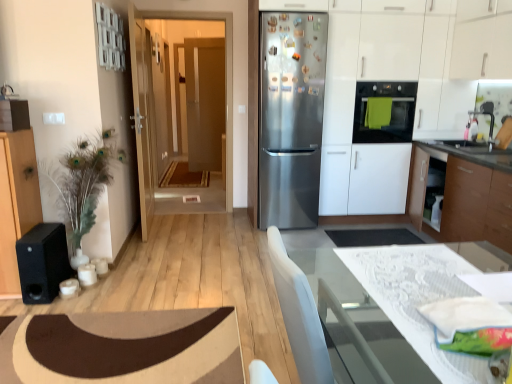
In order to face matte black oven at center right, should I rotate leftwards or rightwards?

Turn right approximately 17.108 degrees to face it.

What do you see at coordinates (205, 101) in the screenshot?
I see `matte wooden door at center, acting as the 2th door starting from the front` at bounding box center [205, 101].

What do you see at coordinates (470, 154) in the screenshot? This screenshot has height=384, width=512. I see `white glossy countertop at lower right` at bounding box center [470, 154].

This screenshot has width=512, height=384. What do you see at coordinates (42, 262) in the screenshot? I see `black matte speaker at left` at bounding box center [42, 262].

The width and height of the screenshot is (512, 384). What do you see at coordinates (143, 116) in the screenshot?
I see `wooden door at center, placed as the 2th door when sorted from back to front` at bounding box center [143, 116].

Measure the distance between point (340, 209) and camera.

Point (340, 209) is 4.31 meters from camera.

This screenshot has height=384, width=512. What do you see at coordinates (290, 116) in the screenshot? I see `stainless steel refrigerator at center` at bounding box center [290, 116].

Describe the element at coordinates (405, 302) in the screenshot. I see `white lace table at lower right` at that location.

This screenshot has height=384, width=512. What are the coordinates of `matte black oven at center right` in the screenshot? It's located at (384, 112).

Based on the photo, from the image's perspective, would you say white glossy countertop at lower right is positioned over satin white cabinet at right?

No, from the image's perspective, white glossy countertop at lower right is not on top of satin white cabinet at right.

At what (x,y) coordinates should I click in order to perform the action: click on countertop in front of the satin white cabinet at right. Please return your answer as a coordinate pair (x, y). The image size is (512, 384). Looking at the image, I should click on (470, 154).

Between white glossy countertop at lower right and satin white cabinet at right, which one is positioned in front?

white glossy countertop at lower right is more forward.

Can you tell me how much white glossy countertop at lower right and satin white cabinet at right differ in facing direction?

The angle between the facing direction of white glossy countertop at lower right and the facing direction of satin white cabinet at right is 90 degrees.

The width and height of the screenshot is (512, 384). Find the location of `dresser behind the wooden door at center, marked as the first door in a front-to-back arrangement`. dresser behind the wooden door at center, marked as the first door in a front-to-back arrangement is located at coordinates (384, 74).

Can we say wooden door at center, marked as the first door in a front-to-back arrangement, lies outside satin white cabinet at right?

Yes, wooden door at center, marked as the first door in a front-to-back arrangement, is outside of satin white cabinet at right.

Between wooden door at center, placed as the 2th door when sorted from back to front, and satin white cabinet at right, which one is positioned behind?

satin white cabinet at right is behind.

Which object is thinner, satin white cabinet at right or white glossy countertop at lower right?

Thinner between the two is white glossy countertop at lower right.

Is the surface of satin white cabinet at right in direct contact with white glossy countertop at lower right?

No.

Which of these two, satin white cabinet at right or white glossy countertop at lower right, is bigger?

satin white cabinet at right.

Can you tell me how much satin white cabinet at right and white glossy countertop at lower right differ in facing direction?

The angle between the facing direction of satin white cabinet at right and the facing direction of white glossy countertop at lower right is 90 degrees.

In terms of size, does satin white cabinet at right appear bigger or smaller than wooden door at center, marked as the first door in a front-to-back arrangement?

In the image, satin white cabinet at right appears to be larger than wooden door at center, marked as the first door in a front-to-back arrangement.

Can wooden door at center, marked as the first door in a front-to-back arrangement, be found inside satin white cabinet at right?

No.

Could you tell me if satin white cabinet at right is turned towards wooden door at center, marked as the first door in a front-to-back arrangement?

No, satin white cabinet at right is not turned towards wooden door at center, marked as the first door in a front-to-back arrangement.

Can you tell me how much satin white cabinet at right and wooden door at center, placed as the 2th door when sorted from back to front, differ in facing direction?

The angular difference between satin white cabinet at right and wooden door at center, placed as the 2th door when sorted from back to front, is 90.8 degrees.

Is transparent glass door at center not within satin white cabinet at right?

Indeed, transparent glass door at center is completely outside satin white cabinet at right.

Where is `dresser in front of the transparent glass door at center`? Image resolution: width=512 pixels, height=384 pixels. dresser in front of the transparent glass door at center is located at coordinates (384, 74).

Is satin white cabinet at right at the back of transparent glass door at center?

No, transparent glass door at center's orientation is not away from satin white cabinet at right.

Consider the image. How different are the orientations of transparent glass door at center and satin white cabinet at right in degrees?

The angle between the facing direction of transparent glass door at center and the facing direction of satin white cabinet at right is 0.274 degrees.

From a real-world perspective, is matte wooden door at center, acting as the 2th door starting from the front, located beneath white lace table at lower right?

No.

Considering the sizes of objects matte wooden door at center, acting as the 2th door starting from the front, and white lace table at lower right in the image provided, who is thinner, matte wooden door at center, acting as the 2th door starting from the front, or white lace table at lower right?

With smaller width is matte wooden door at center, acting as the 2th door starting from the front.

Is matte wooden door at center, marked as the first door in a back-to-front arrangement, oriented away from white lace table at lower right?

No, matte wooden door at center, marked as the first door in a back-to-front arrangement, is not facing away from white lace table at lower right.

From the picture: Does matte wooden door at center, marked as the first door in a back-to-front arrangement, have a lesser height compared to white lace table at lower right?

Incorrect, the height of matte wooden door at center, marked as the first door in a back-to-front arrangement, does not fall short of that of white lace table at lower right.

Is satin white cabinet at right next to black matte speaker at left and touching it?

satin white cabinet at right and black matte speaker at left are clearly separated.

Choose the correct answer: Is satin white cabinet at right inside black matte speaker at left or outside it?

satin white cabinet at right lies outside black matte speaker at left.

Can you tell me how much satin white cabinet at right and black matte speaker at left differ in facing direction?

1.18 degrees.

Is satin white cabinet at right shorter than black matte speaker at left?

Incorrect, the height of satin white cabinet at right does not fall short of that of black matte speaker at left.

Identify the location of countertop that is below the satin white cabinet at right (from the image's perspective). The height and width of the screenshot is (384, 512). (470, 154).

This screenshot has height=384, width=512. In order to click on door located in front of the satin white cabinet at right in this screenshot , I will do `click(143, 116)`.

Which object lies further to the anchor point black matte speaker at left, white glossy countertop at lower right or stainless steel refrigerator at center?

white glossy countertop at lower right is further to black matte speaker at left.

Looking at the image, which one is located closer to satin white cabinet at right, matte black oven at center right or transparent glass door at center?

matte black oven at center right is closer to satin white cabinet at right.

When comparing their distances from wooden door at center, placed as the 2th door when sorted from back to front, does stainless steel refrigerator at center or brown carpet at lower left seem closer?

stainless steel refrigerator at center lies closer to wooden door at center, placed as the 2th door when sorted from back to front, than the other object.

Based on the photo, looking at the image, which one is located further to transparent glass door at center, matte black oven at center right or black matte speaker at left?

The object further to transparent glass door at center is matte black oven at center right.

Estimate the real-world distances between objects in this image. Which object is closer to white glossy countertop at lower right, brown carpet at lower left or wooden door at center, marked as the first door in a front-to-back arrangement?

Based on the image, wooden door at center, marked as the first door in a front-to-back arrangement, appears to be nearer to white glossy countertop at lower right.

Considering their positions, is satin white cabinet at right positioned closer to transparent glass door at center than matte wooden door at center, acting as the 2th door starting from the front?

satin white cabinet at right.

Which object lies further to the anchor point white lace table at lower right, black matte speaker at left or wooden door at center, placed as the 2th door when sorted from back to front?

The object further to white lace table at lower right is wooden door at center, placed as the 2th door when sorted from back to front.

Estimate the real-world distances between objects in this image. Which object is closer to satin white cabinet at right, white glossy countertop at lower right or stainless steel refrigerator at center?

stainless steel refrigerator at center is closer to satin white cabinet at right.

This screenshot has width=512, height=384. In order to click on refrigerator located between transparent glass door at center and satin white cabinet at right in the left-right direction in this screenshot , I will do click(290, 116).

Locate an element on the screen. door between brown carpet at lower left and transparent glass door at center along the z-axis is located at coordinates (143, 116).

Where is `dresser between wooden door at center, marked as the first door in a front-to-back arrangement, and matte wooden door at center, acting as the 2th door starting from the front, from front to back`? This screenshot has width=512, height=384. dresser between wooden door at center, marked as the first door in a front-to-back arrangement, and matte wooden door at center, acting as the 2th door starting from the front, from front to back is located at coordinates (384, 74).

Find the location of a particular element. Image resolution: width=512 pixels, height=384 pixels. appliance positioned between white lace table at lower right and wooden door at center, marked as the first door in a front-to-back arrangement, from near to far is located at coordinates (42, 262).